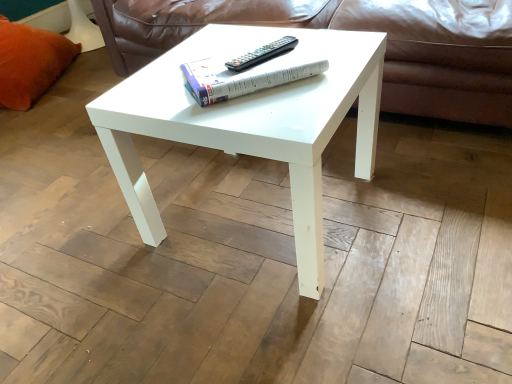
Question: Is orange plush pillow at left bigger than white paper at center?

Choices:
 (A) no
 (B) yes

Answer: (B)

Question: Can you confirm if orange plush pillow at left is taller than white paper at center?

Choices:
 (A) yes
 (B) no

Answer: (A)

Question: Does orange plush pillow at left appear on the left side of white paper at center?

Choices:
 (A) no
 (B) yes

Answer: (B)

Question: Can you confirm if orange plush pillow at left is thinner than white paper at center?

Choices:
 (A) yes
 (B) no

Answer: (B)

Question: Is orange plush pillow at left not inside white paper at center?

Choices:
 (A) no
 (B) yes

Answer: (B)

Question: Does orange plush pillow at left turn towards white paper at center?

Choices:
 (A) yes
 (B) no

Answer: (A)

Question: Is leather at center positioned behind orange plush pillow at left?

Choices:
 (A) no
 (B) yes

Answer: (A)

Question: From a real-world perspective, is leather at center located beneath orange plush pillow at left?

Choices:
 (A) no
 (B) yes

Answer: (A)

Question: Does leather at center have a lesser height compared to orange plush pillow at left?

Choices:
 (A) yes
 (B) no

Answer: (A)

Question: Is leather at center wider than orange plush pillow at left?

Choices:
 (A) yes
 (B) no

Answer: (A)

Question: From the image's perspective, is leather at center on orange plush pillow at left?

Choices:
 (A) no
 (B) yes

Answer: (A)

Question: Is leather at center located outside orange plush pillow at left?

Choices:
 (A) yes
 (B) no

Answer: (A)

Question: Can you confirm if orange plush pillow at left is positioned to the left of white glossy coffee table at center?

Choices:
 (A) yes
 (B) no

Answer: (A)